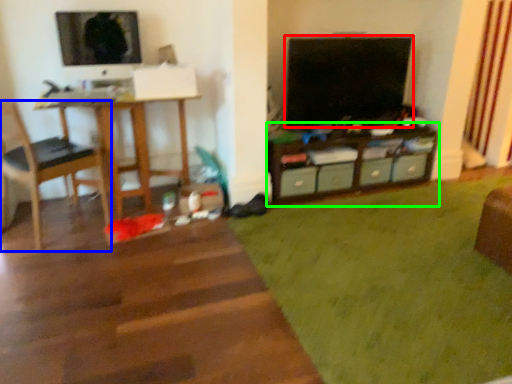
Question: Estimate the real-world distances between objects in this image. Which object is closer to television (highlighted by a red box), chair (highlighted by a blue box) or shelf (highlighted by a green box)?

Choices:
 (A) chair
 (B) shelf

Answer: (B)